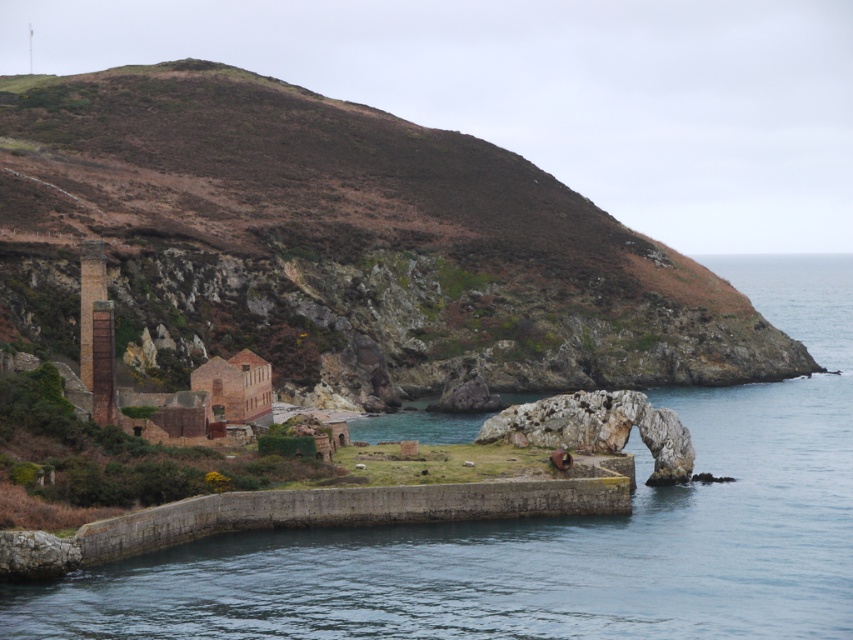
Question: Is brown rocky hillside at upper left to the left of concrete wall at center from the viewer's perspective?

Choices:
 (A) yes
 (B) no

Answer: (A)

Question: Which object is closer to the camera taking this photo?

Choices:
 (A) brown rocky hillside at upper left
 (B) concrete wall at center

Answer: (B)

Question: Can you confirm if brown rocky hillside at upper left is wider than concrete wall at center?

Choices:
 (A) yes
 (B) no

Answer: (A)

Question: Does brown rocky hillside at upper left have a larger size compared to concrete wall at center?

Choices:
 (A) no
 (B) yes

Answer: (A)

Question: Which point is closer to the camera?

Choices:
 (A) brown rocky hillside at upper left
 (B) concrete wall at center

Answer: (B)